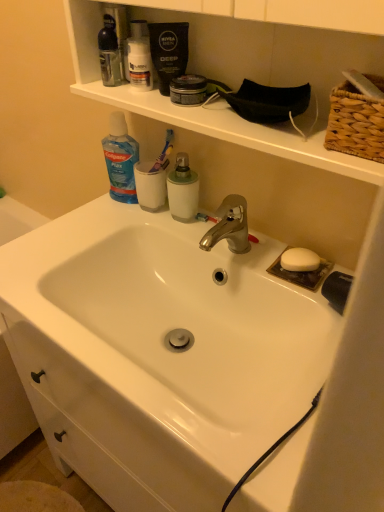
Question: Is blue translucent liquid at upper left at the right side of white matte mouthwash at center, which appears as the first mouthwash when ordered from the bottom?

Choices:
 (A) no
 (B) yes

Answer: (A)

Question: Is the depth of blue translucent liquid at upper left less than that of white matte mouthwash at center, which appears as the first mouthwash when ordered from the bottom?

Choices:
 (A) yes
 (B) no

Answer: (B)

Question: Is blue translucent liquid at upper left smaller than white matte mouthwash at center, the first mouthwash from the right?

Choices:
 (A) no
 (B) yes

Answer: (A)

Question: Can you confirm if blue translucent liquid at upper left is shorter than white matte mouthwash at center, the first mouthwash from the right?

Choices:
 (A) yes
 (B) no

Answer: (B)

Question: Is blue translucent liquid at upper left positioned far away from white matte mouthwash at center, which is the second mouthwash from left to right?

Choices:
 (A) yes
 (B) no

Answer: (B)

Question: Considering the relative sizes of blue translucent liquid at upper left and white matte mouthwash at center, the first mouthwash from the right, in the image provided, is blue translucent liquid at upper left wider than white matte mouthwash at center, the first mouthwash from the right,?

Choices:
 (A) yes
 (B) no

Answer: (A)

Question: From a real-world perspective, is red plastic toothbrush at center, which is the 2th toothbrush from top to bottom, located beneath white matte mouthwash at center, which is the second mouthwash from left to right?

Choices:
 (A) yes
 (B) no

Answer: (A)

Question: From the image's perspective, is red plastic toothbrush at center, which is the 2th toothbrush from top to bottom, located beneath white matte mouthwash at center, placed as the 2th mouthwash when sorted from top to bottom?

Choices:
 (A) no
 (B) yes

Answer: (B)

Question: Is there a large distance between red plastic toothbrush at center, the first toothbrush ordered from the bottom, and white matte mouthwash at center, which appears as the first mouthwash when ordered from the bottom?

Choices:
 (A) no
 (B) yes

Answer: (A)

Question: Does red plastic toothbrush at center, positioned as the 1th toothbrush in right-to-left order, come behind white matte mouthwash at center, which is the second mouthwash from left to right?

Choices:
 (A) yes
 (B) no

Answer: (A)

Question: Is red plastic toothbrush at center, which is the 2th toothbrush from top to bottom, positioned beyond the bounds of white matte mouthwash at center, the first mouthwash from the right?

Choices:
 (A) yes
 (B) no

Answer: (A)

Question: Considering the relative sizes of red plastic toothbrush at center, the first toothbrush ordered from the bottom, and white matte mouthwash at center, placed as the 2th mouthwash when sorted from top to bottom, in the image provided, is red plastic toothbrush at center, the first toothbrush ordered from the bottom, shorter than white matte mouthwash at center, placed as the 2th mouthwash when sorted from top to bottom,?

Choices:
 (A) yes
 (B) no

Answer: (A)

Question: Is red plastic toothbrush at center, which is the second toothbrush from left to right, facing away from matte plastic shaving cream canister at upper center?

Choices:
 (A) yes
 (B) no

Answer: (B)